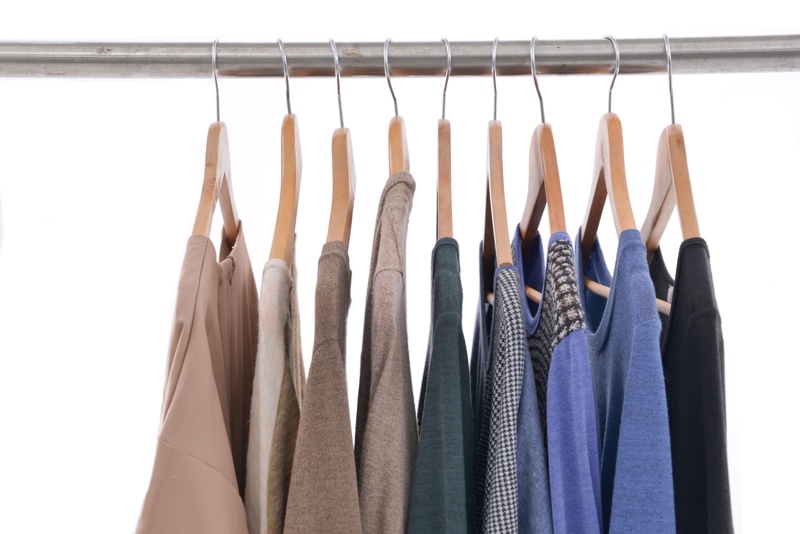
The height and width of the screenshot is (534, 800). I want to click on hangers, so click(202, 227), click(278, 227), click(340, 230), click(401, 162), click(445, 198), click(502, 230), click(560, 222), click(621, 222), click(682, 219).